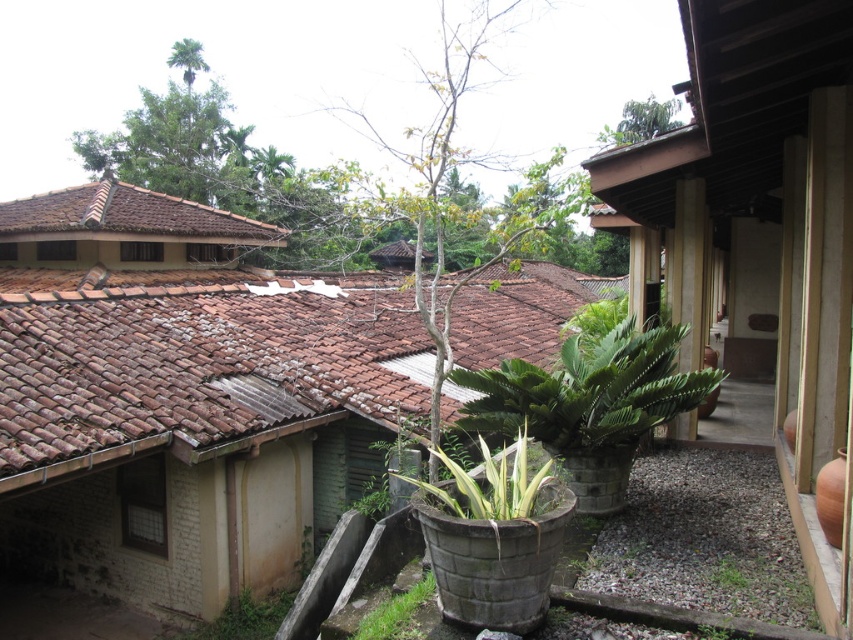
In the scene shown: Is brown clay tiles at upper left positioned in front of green leafy tree at center?

Yes, brown clay tiles at upper left is in front of green leafy tree at center.

Based on the photo, which of these two, brown clay tiles at upper left or green leafy tree at center, stands taller?

green leafy tree at center is taller.

Is point (126, 236) less distant than point (497, 12)?

Yes, it is in front of point (497, 12).

Where is `brown clay tiles at upper left`? The width and height of the screenshot is (853, 640). brown clay tiles at upper left is located at coordinates (180, 336).

Can you confirm if brown clay tiles at upper left is bigger than green leafy tree at upper center?

Indeed, brown clay tiles at upper left has a larger size compared to green leafy tree at upper center.

Can you confirm if brown clay tiles at upper left is positioned below green leafy tree at upper center?

Yes.

Which is behind, point (358, 410) or point (653, 109)?

The point (653, 109) is more distant.

Identify the location of brown clay tiles at upper left. (180, 336).

Which is more to the right, green leafy tree at center or green leafy tree at upper center?

Positioned to the right is green leafy tree at upper center.

Identify the location of green leafy tree at center. The width and height of the screenshot is (853, 640). (453, 188).